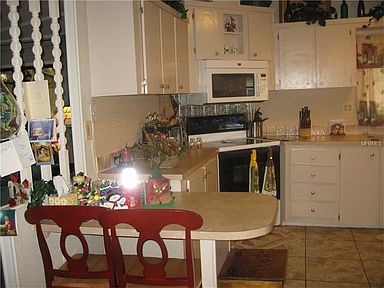
This screenshot has width=384, height=288. Find the location of `silver drawer knob`. silver drawer knob is located at coordinates (312, 172).